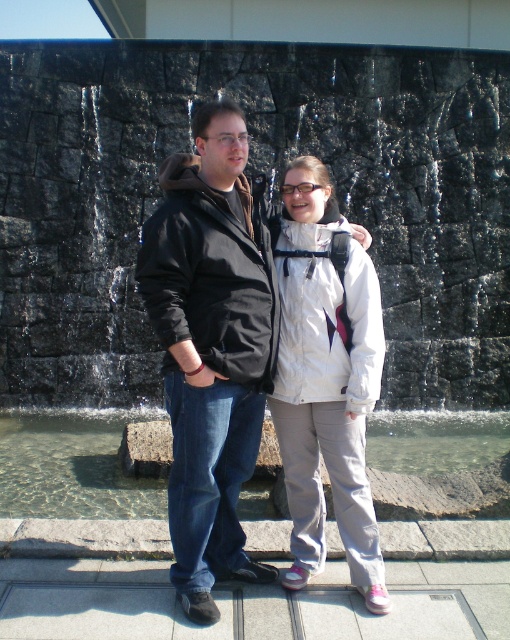
Question: Which of the following is the closest to the observer?

Choices:
 (A) (233, 278)
 (B) (65, 429)
 (C) (291, 580)

Answer: (A)

Question: Can you confirm if matte black jacket at center is smaller than clear glass water at lower center?

Choices:
 (A) yes
 (B) no

Answer: (B)

Question: Which point is farther to the camera?

Choices:
 (A) (255, 508)
 (B) (328, 216)

Answer: (A)

Question: Is white matte jacket at center smaller than clear glass water at lower center?

Choices:
 (A) no
 (B) yes

Answer: (A)

Question: Considering the real-world distances, which object is farthest from the white matte jacket at center?

Choices:
 (A) matte black jacket at center
 (B) clear glass water at lower center

Answer: (B)

Question: Does matte black jacket at center appear on the right side of white matte jacket at center?

Choices:
 (A) no
 (B) yes

Answer: (A)